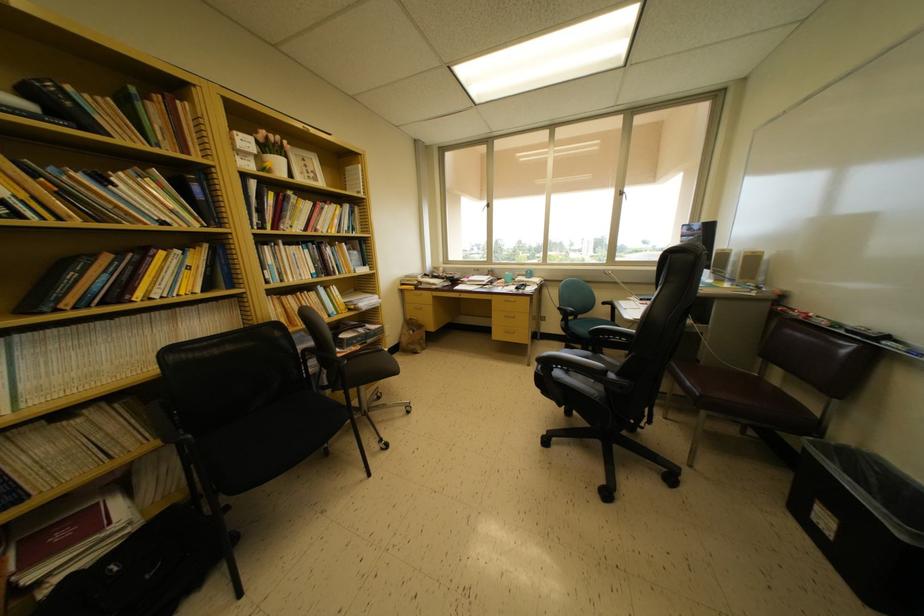
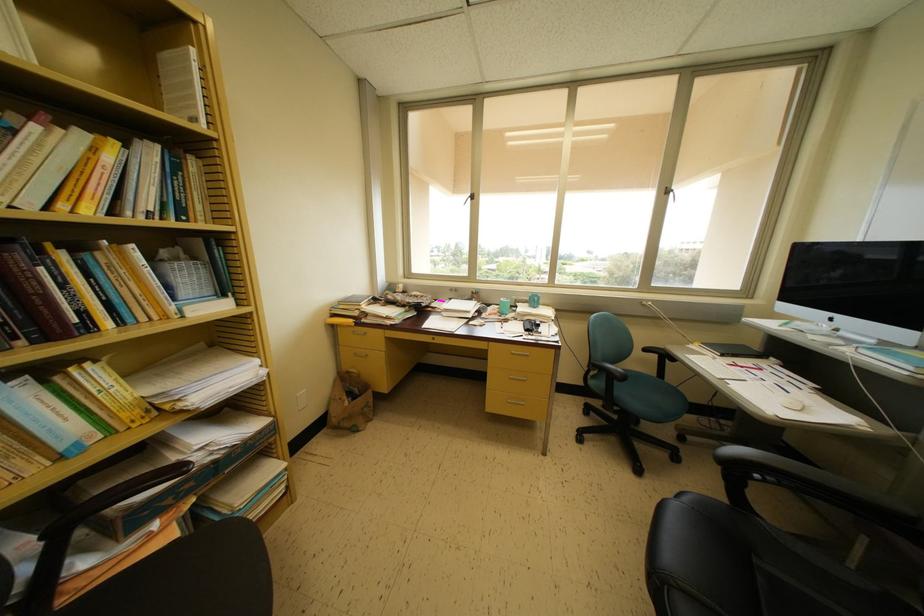
In the second image, find the point that corresponds to [417,292] in the first image.

(355, 326)